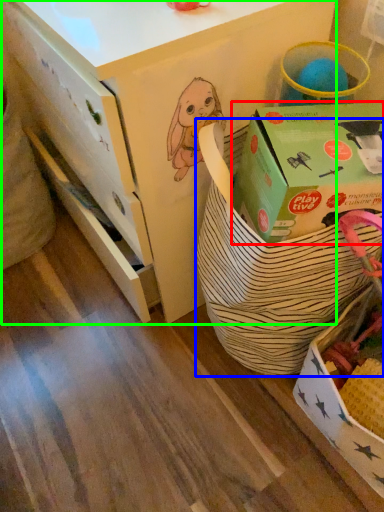
Question: Which object is the closest to the box (highlighted by a red box)? Choose among these: gift basket (highlighted by a blue box) or desk (highlighted by a green box).

Choices:
 (A) gift basket
 (B) desk

Answer: (A)